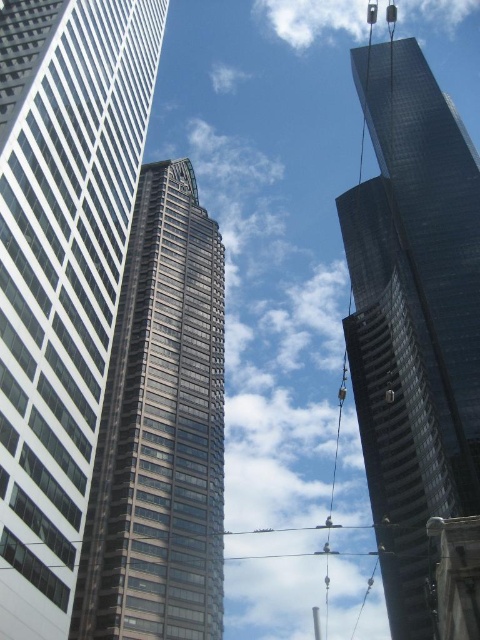
Question: Observing the image, what is the correct spatial positioning of white glass skyscraper at left in reference to glassy reflective skyscraper at center?

Choices:
 (A) left
 (B) right

Answer: (A)

Question: Can you confirm if white glass skyscraper at left is wider than glossy glass skyscraper at upper right?

Choices:
 (A) no
 (B) yes

Answer: (A)

Question: Is white glass skyscraper at left to the left of glassy reflective skyscraper at center from the viewer's perspective?

Choices:
 (A) no
 (B) yes

Answer: (B)

Question: Among these points, which one is nearest to the camera?

Choices:
 (A) (155, 481)
 (B) (64, 538)

Answer: (B)

Question: Which point is closer to the camera?

Choices:
 (A) (215, 538)
 (B) (49, 10)
 (C) (396, 317)

Answer: (B)

Question: Which object is closer to the camera taking this photo?

Choices:
 (A) white glass skyscraper at left
 (B) glossy glass skyscraper at upper right

Answer: (A)